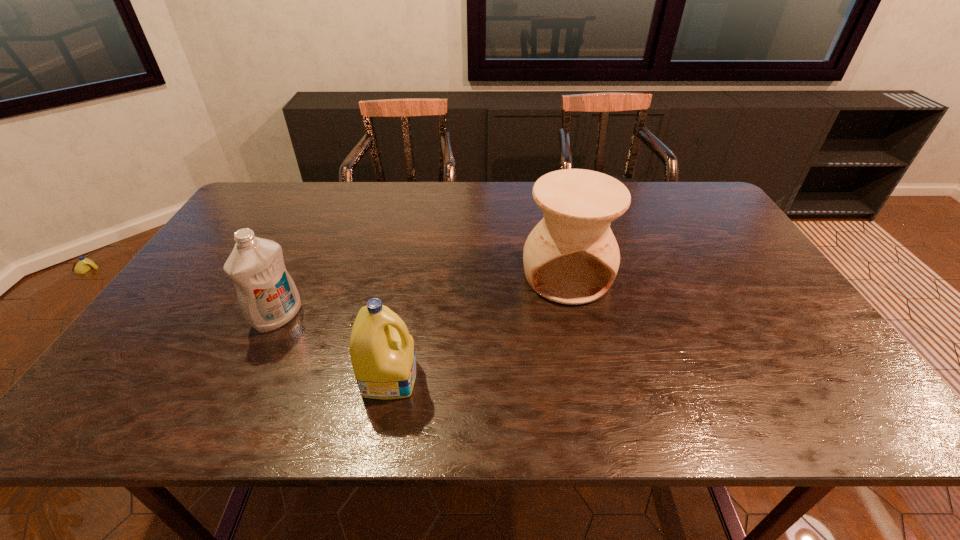
What are the coordinates of `empty space that is in between the pottery and the nearer detergent` in the screenshot? It's located at (478, 327).

The width and height of the screenshot is (960, 540). Find the location of `vacant area between the rightmost object and the leftmost object`. vacant area between the rightmost object and the leftmost object is located at coordinates click(x=422, y=297).

Where is `vacant area that lies between the left detergent and the rightmost object`? vacant area that lies between the left detergent and the rightmost object is located at coordinates (422, 297).

Where is `vacant region between the pottery and the second object from right to left`? vacant region between the pottery and the second object from right to left is located at coordinates (478, 327).

The width and height of the screenshot is (960, 540). I want to click on unoccupied position between the rightmost object and the right detergent, so click(x=478, y=327).

The height and width of the screenshot is (540, 960). I want to click on object that ranks as the second closest to the rightmost object, so click(268, 297).

Find the location of a particular element. The image size is (960, 540). the second closest object to the rightmost object is located at coordinates (268, 297).

Locate an element on the screen. The height and width of the screenshot is (540, 960). vacant space that satisfies the following two spatial constraints: 1. at the open side of the pottery; 2. on the label of the right detergent is located at coordinates (589, 377).

The height and width of the screenshot is (540, 960). What are the coordinates of `free space that satisfies the following two spatial constraints: 1. at the open side of the rightmost object; 2. on the label of the shorter detergent` in the screenshot? It's located at (589, 377).

Locate an element on the screen. The width and height of the screenshot is (960, 540). free space that satisfies the following two spatial constraints: 1. at the open side of the pottery; 2. on the label of the shortest object is located at coordinates (589, 377).